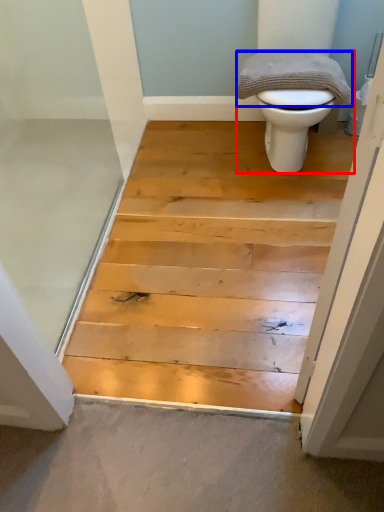
Question: Which of the following is the farthest to the observer, toilet (highlighted by a red box) or material (highlighted by a blue box)?

Choices:
 (A) toilet
 (B) material

Answer: (B)